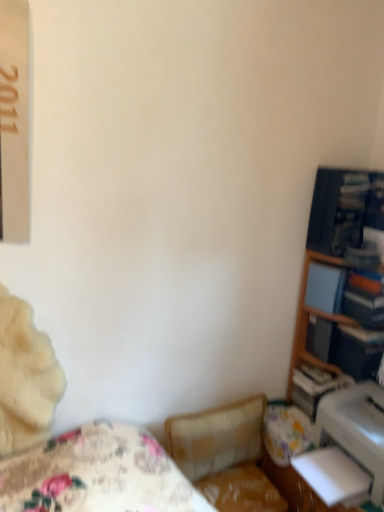
Question: From the image's perspective, is hardcover book at right, placed as the 2th paperback book when sorted from top to bottom, located above or below white glossy printer at lower right?

Choices:
 (A) below
 (B) above

Answer: (B)

Question: Is point (357, 351) closer or farther from the camera than point (360, 408)?

Choices:
 (A) closer
 (B) farther

Answer: (B)

Question: Which of these objects is positioned farthest from the matte blue paperback book at right, the first paperback book when ordered from top to bottom?

Choices:
 (A) plush beige swivel chair at center
 (B) wooden bookshelf at right
 (C) white glossy printer at lower right
 (D) hardcover book at right, placed as the 2th paperback book when sorted from top to bottom
 (E) wooden bookshelf at right

Answer: (A)

Question: Based on their relative distances, which object is nearer to the white glossy printer at lower right?

Choices:
 (A) hardcover book at right, which is counted as the first paperback book, starting from the right
 (B) wooden bookshelf at right
 (C) wooden bookshelf at right
 (D) matte blue paperback book at right, the first paperback book when ordered from top to bottom
 (E) plush beige swivel chair at center

Answer: (A)